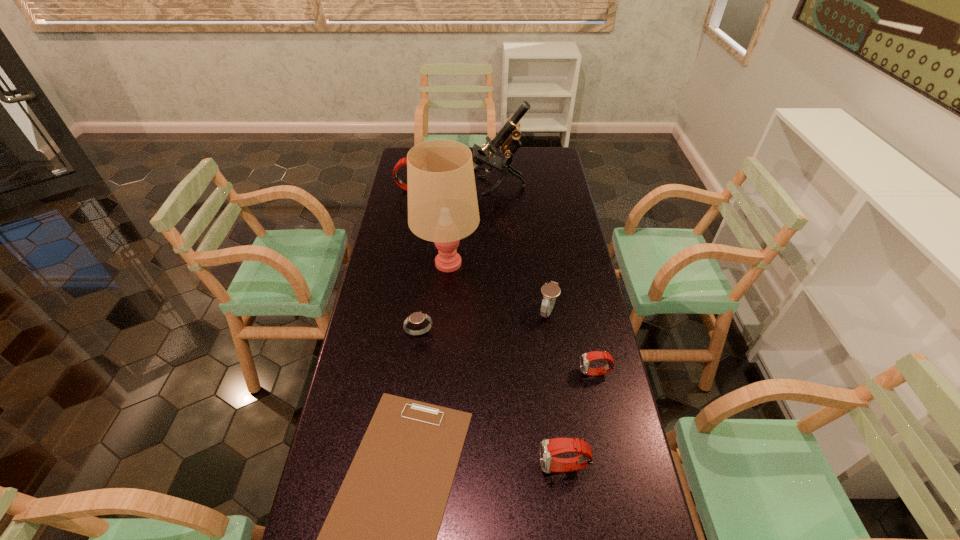
This screenshot has height=540, width=960. In order to click on free space between the rightmost watch and the sixth nearest object in this screenshot , I will do `click(521, 318)`.

Identify the location of unoccupied area between the lampshade and the fourth farthest watch. (521, 318).

Where is `blank region between the third nearest watch and the nearest red watch`? The height and width of the screenshot is (540, 960). blank region between the third nearest watch and the nearest red watch is located at coordinates (492, 400).

Locate an element on the screen. This screenshot has height=540, width=960. free point between the bigger gray watch and the second red watch from right to left is located at coordinates [x=556, y=389].

Identify the location of vacant area that lies between the third farthest watch and the fourth farthest object. (484, 322).

Locate an element on the screen. The image size is (960, 540). object that is the seventh closest one to the tallest watch is located at coordinates (548, 447).

Where is `object that can be found as the fourth closest to the brown clipboard`? The image size is (960, 540). object that can be found as the fourth closest to the brown clipboard is located at coordinates (550, 291).

The height and width of the screenshot is (540, 960). Identify the location of watch identified as the closest to the second biggest red watch. (586, 358).

Locate which watch ranks third in proximity to the second red watch from left to right. Please provide its 2D coordinates. Your answer should be formatted as a tuple, i.e. [(x, y)], where the tuple contains the x and y coordinates of a point satisfying the conditions above.

[(417, 317)]

Where is `red watch that is the second closest to the farthest red watch`? red watch that is the second closest to the farthest red watch is located at coordinates (548, 447).